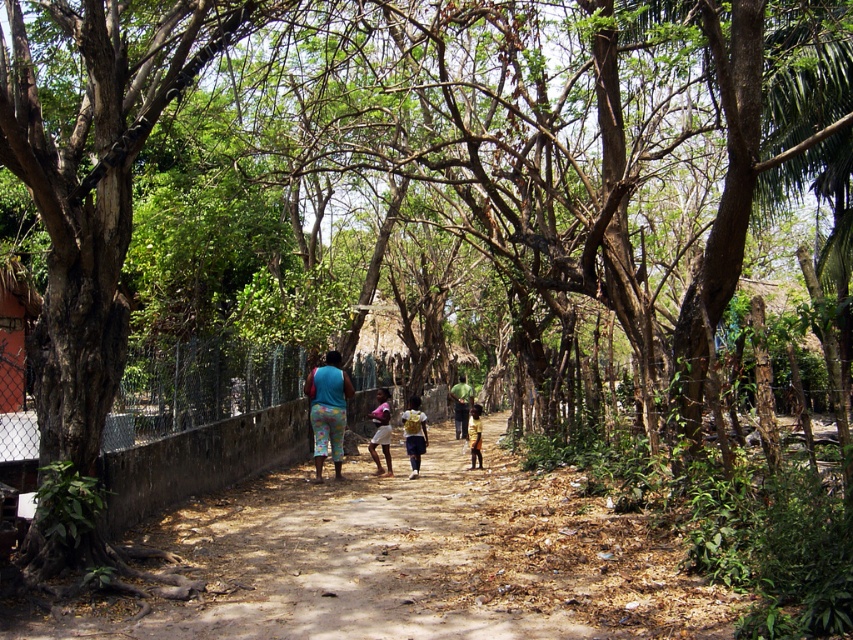
You are a photographer trying to capture a photo of the dark green fabric at center and the yellow fabric child at center. Which object should you focus on first if you want to ensure both are in sharp focus?

The dark green fabric at center is much taller than the yellow fabric child at center, so you should focus on the dark green fabric at center first to ensure both are in sharp focus.